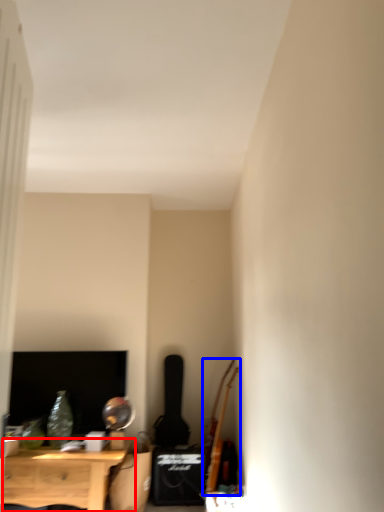
Question: Which point is closer to the camera, nightstand (highlighted by a red box) or instrument (highlighted by a blue box)?

Choices:
 (A) nightstand
 (B) instrument

Answer: (A)